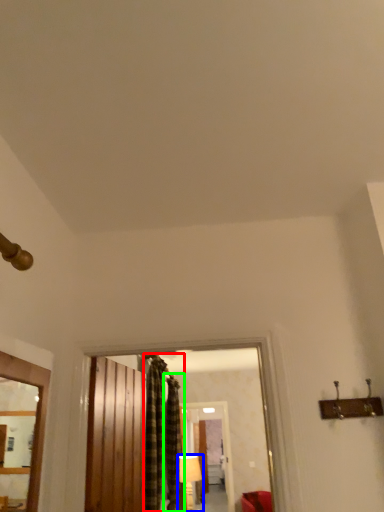
Question: Based on their relative distances, which object is farther from curtain (highlighted by a red box)? Choose from lamp (highlighted by a blue box) and curtain (highlighted by a green box).

Choices:
 (A) lamp
 (B) curtain

Answer: (A)